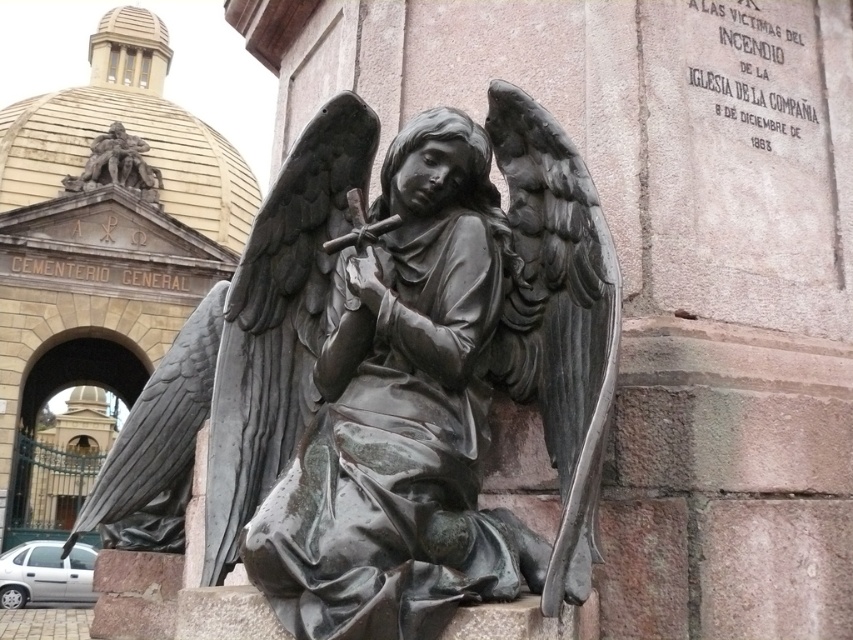
You are an art student visiting a cemetery and see the bronze statue at center and the bronze sculpture at upper left. Which one is taller?

The bronze sculpture at upper left is taller than the bronze statue at center.

You are standing in front of the cemetery entrance and see the bronze statue at center and the bronze sculpture at upper left. Which one is positioned to the right side from your perspective?

The bronze statue at center is positioned to the right of the bronze sculpture at upper left, so the bronze statue at center is on the right side from your perspective.

In the scene shown: You are a tour guide explaining the cemetery to visitors. You point out the bronze statue at center and the bronze sculpture at upper left. Which one is bigger?

The bronze sculpture at upper left is bigger than the bronze statue at center.